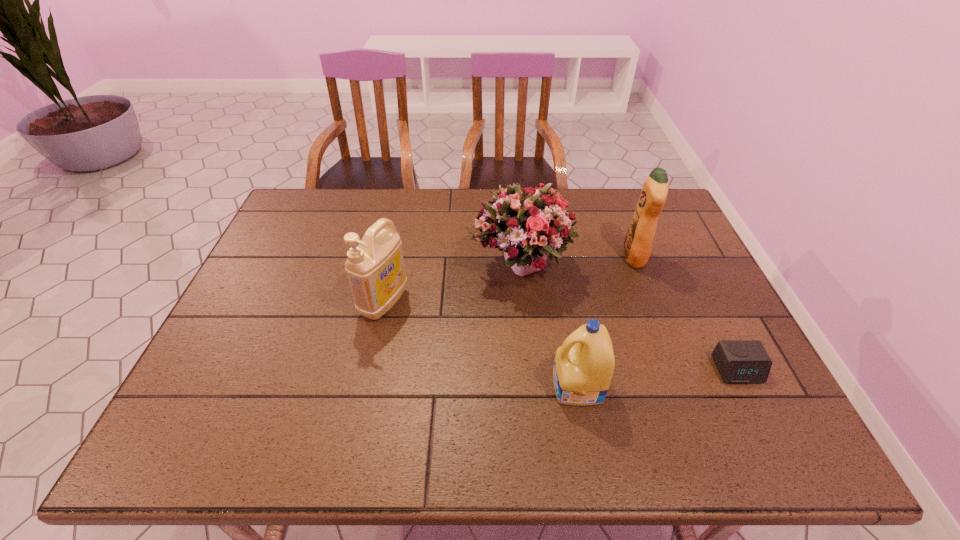
Locate an element on the screen. The width and height of the screenshot is (960, 540). vacant region located 0.230m on the label of the second object from right to left is located at coordinates (545, 257).

The image size is (960, 540). Find the location of `free location located 0.270m on the label of the second object from right to left`. free location located 0.270m on the label of the second object from right to left is located at coordinates (532, 257).

Locate an element on the screen. The height and width of the screenshot is (540, 960). vacant region located 0.090m on the right of the leftmost detergent is located at coordinates (441, 302).

You are a GUI agent. You are given a task and a screenshot of the screen. Output one action in this format:
    pyautogui.click(x=<x>, y=<y>)
    Task: Click on the vacant space located 0.050m on the back of the bouquet
    This screenshot has height=540, width=960.
    Given the screenshot: What is the action you would take?
    pyautogui.click(x=517, y=226)

What are the coordinates of `blank space located 0.110m on the label of the nearest detergent` in the screenshot? It's located at [504, 386].

At what (x,y) coordinates should I click in order to perform the action: click on vacant space located on the label of the nearest detergent. Please return your answer as a coordinate pair (x, y). The width and height of the screenshot is (960, 540). Looking at the image, I should click on (451, 386).

This screenshot has width=960, height=540. In order to click on free space located on the label of the nearest detergent in this screenshot , I will do `click(380, 386)`.

This screenshot has width=960, height=540. I want to click on blank area located 0.160m on the front-facing side of the alarm clock, so click(x=779, y=454).

The width and height of the screenshot is (960, 540). In order to click on detergent located in the right edge section of the desktop in this screenshot , I will do `click(638, 242)`.

At what (x,y) coordinates should I click in order to perform the action: click on alarm clock that is at the right edge. Please return your answer as a coordinate pair (x, y). The image size is (960, 540). Looking at the image, I should click on (738, 361).